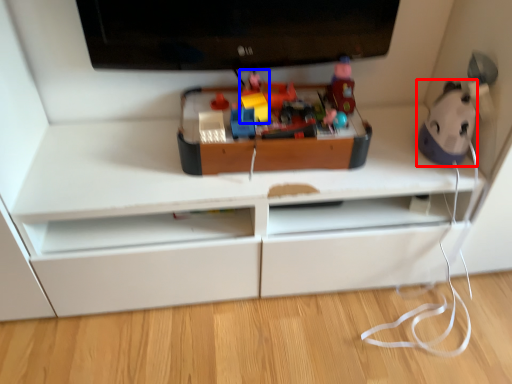
Question: Among these objects, which one is farthest to the camera, toy (highlighted by a red box) or toy (highlighted by a blue box)?

Choices:
 (A) toy
 (B) toy

Answer: (B)